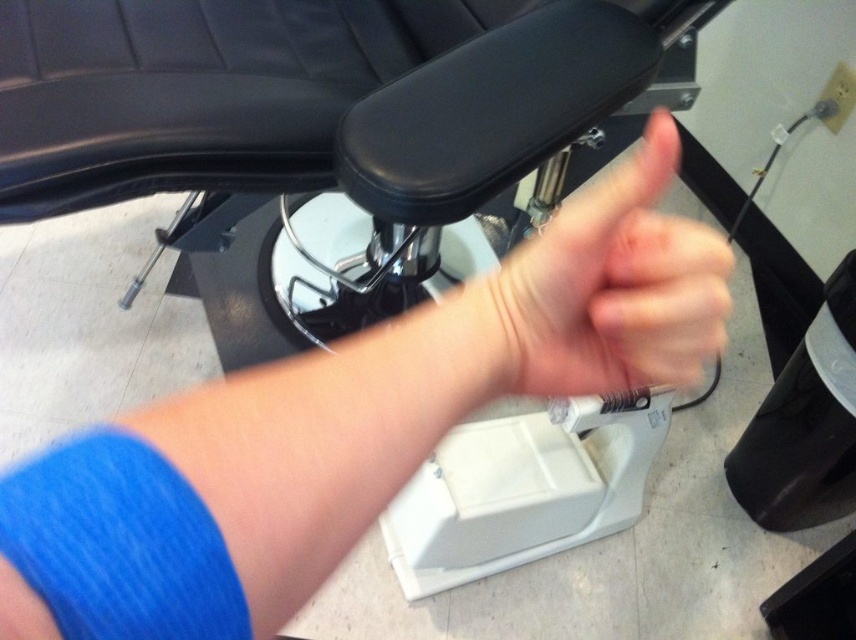
You are a technician in a clinic. You need to place a new sensor on the point at coordinate point (165,432). The sensor has a diameter of 2 inches. Can you determine if the sensor will fit at that location without overlapping any nearby objects?

The point at coordinate point (165,432) is 7.93 inches away from the camera. Since the sensor has a diameter of 2 inches, there is sufficient space to place it at that location without overlapping nearby objects.

You are a nurse checking the equipment in the room. You notice the blue fabric arm at center and the skinny white hand at center. Which object is smaller in size?

The blue fabric arm at center is smaller in size compared to the skinny white hand at center according to the description.